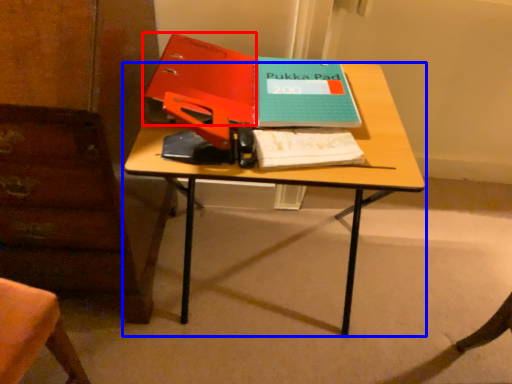
Question: Among these objects, which one is farthest to the camera, paperback book (highlighted by a red box) or desk (highlighted by a blue box)?

Choices:
 (A) paperback book
 (B) desk

Answer: (A)